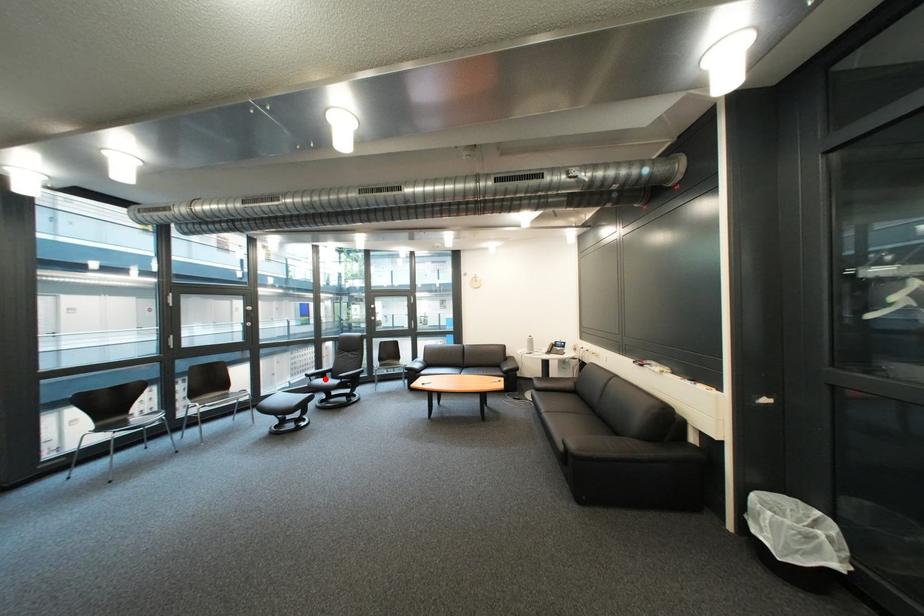
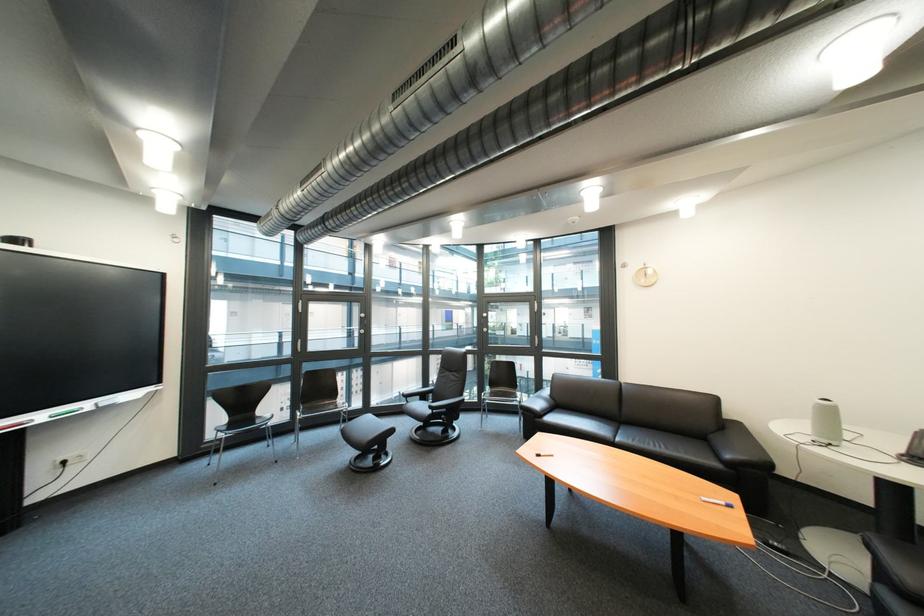
Where in the second image is the point corresponding to the highlighted location from the first image?

(421, 400)